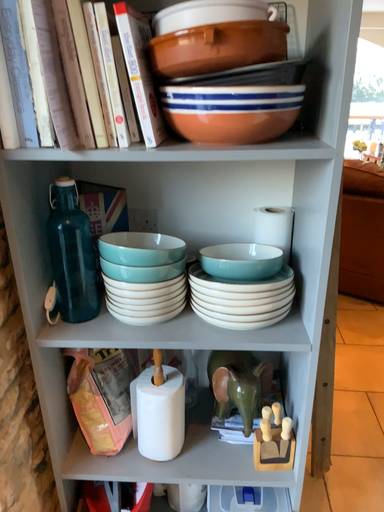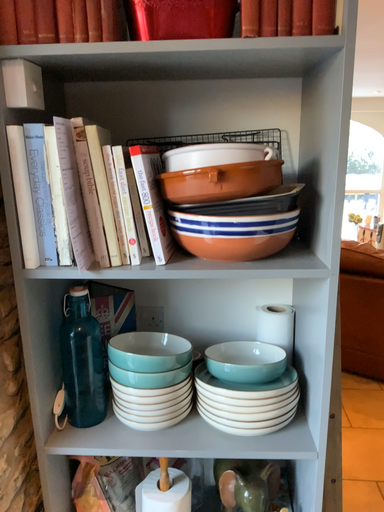
Question: Which way did the camera rotate in the video?

Choices:
 (A) rotated downward
 (B) rotated upward

Answer: (B)